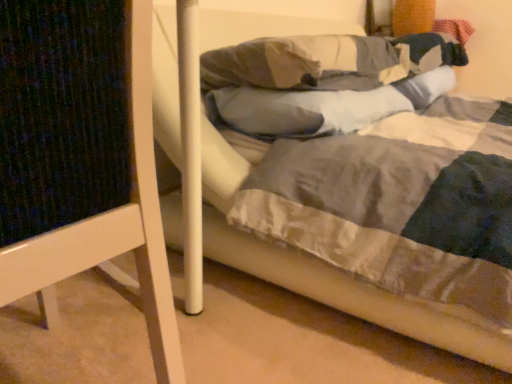
The height and width of the screenshot is (384, 512). In order to click on spots to the right of white wood bed frame at left in this screenshot , I will do `click(275, 329)`.